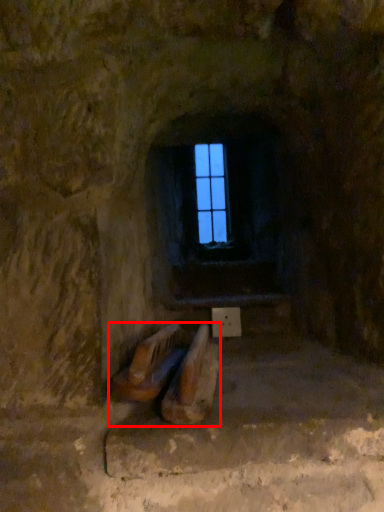
Question: In this image, where is furniture (annotated by the red box) located relative to window frame?

Choices:
 (A) right
 (B) left

Answer: (B)